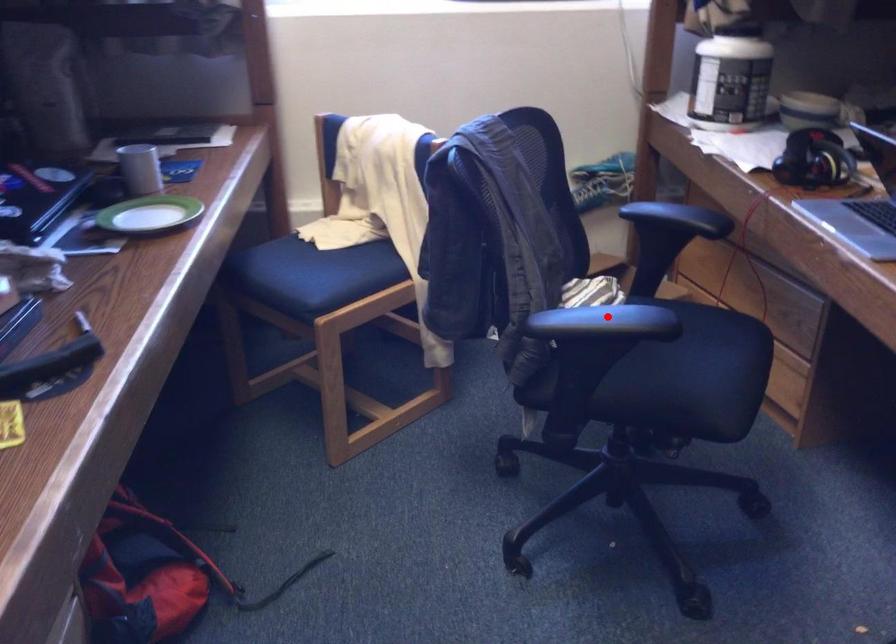
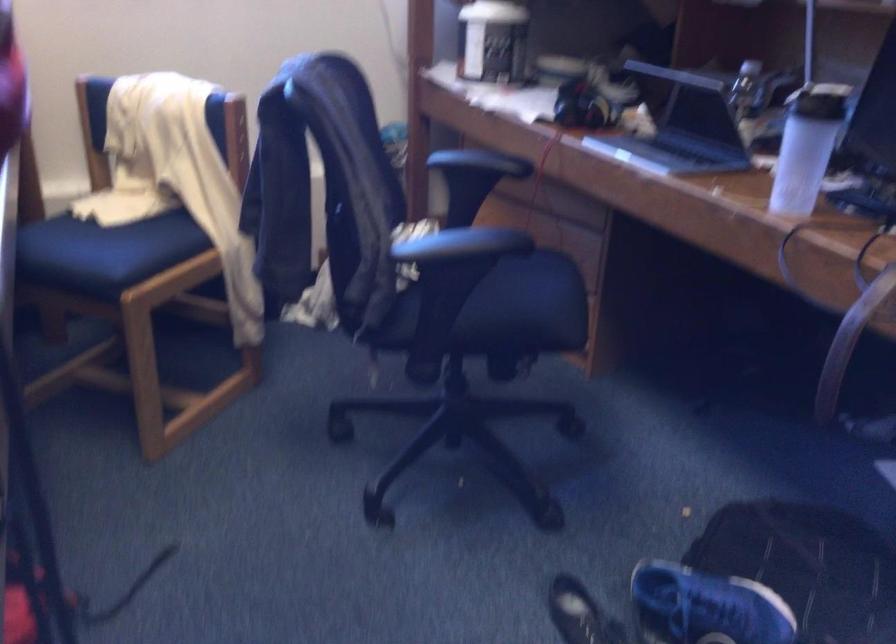
Where in the second image is the point corresponding to the highlighted location from the first image?

(471, 242)